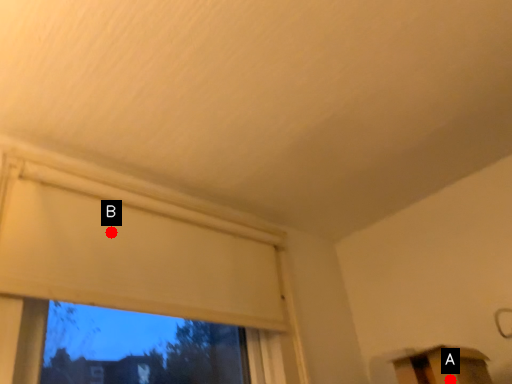
Question: Two points are circled on the image, labeled by A and B beside each circle. Which of the following is the closest to the observer?

Choices:
 (A) A is closer
 (B) B is closer

Answer: (A)